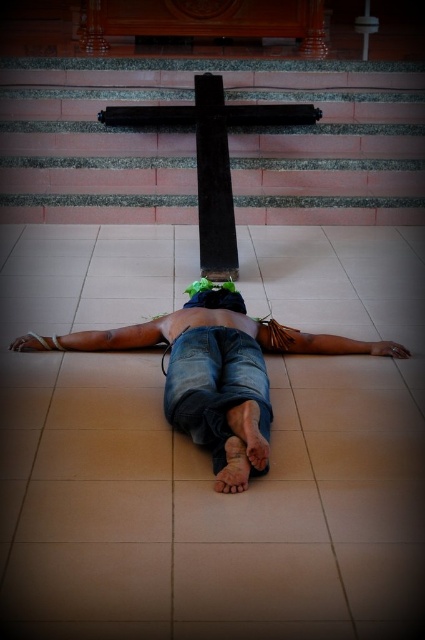
Which is more to the left, black polished wood crucifix at center or green fabric head at center?

From the viewer's perspective, black polished wood crucifix at center appears more on the left side.

Does point (220, 116) lie behind point (201, 288)?

Yes.

This screenshot has width=425, height=640. What are the coordinates of `black polished wood crucifix at center` in the screenshot? It's located at [x=212, y=156].

Between black polished wood crucifix at center and black polished wood cross at center, which one is positioned lower?

black polished wood crucifix at center is lower down.

Who is taller, black polished wood crucifix at center or black polished wood cross at center?

Standing taller between the two is black polished wood cross at center.

Which is in front, point (220, 76) or point (207, 150)?

Positioned in front is point (207, 150).

In order to click on black polished wood crucifix at center in this screenshot , I will do `click(212, 156)`.

Can you confirm if blue denim jeans at center is shorter than black polished wood crucifix at center?

Yes.

Describe the element at coordinates (215, 376) in the screenshot. The width and height of the screenshot is (425, 640). I see `blue denim jeans at center` at that location.

Which is in front, point (221, 410) or point (210, 172)?

Point (221, 410) is more forward.

What are the coordinates of `blue denim jeans at center` in the screenshot? It's located at (215, 376).